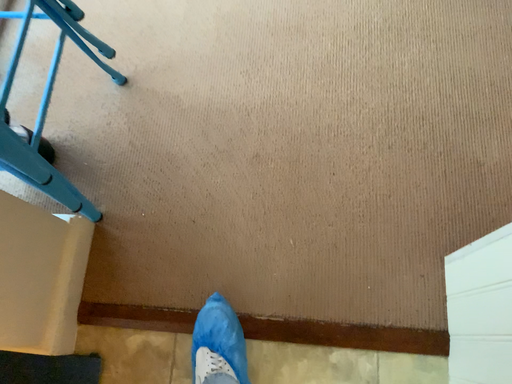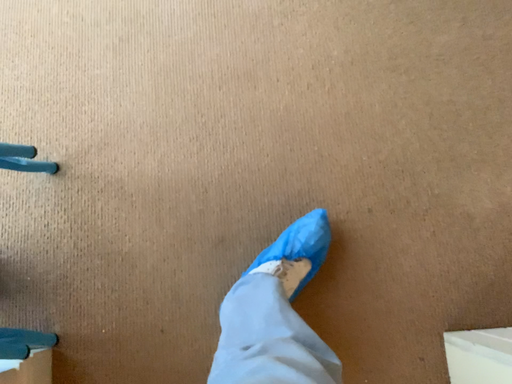
Question: Which way did the camera rotate in the video?

Choices:
 (A) rotated downward
 (B) rotated upward

Answer: (A)